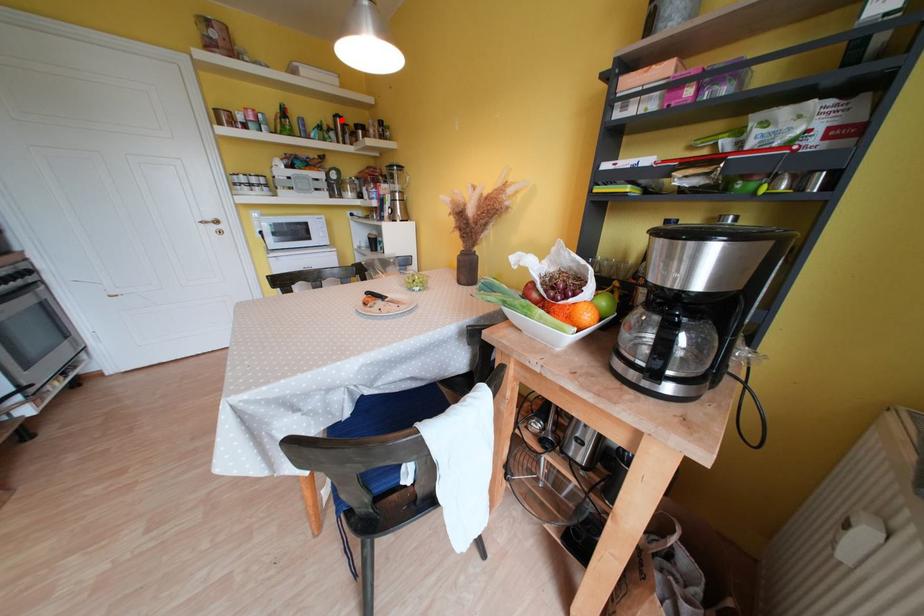
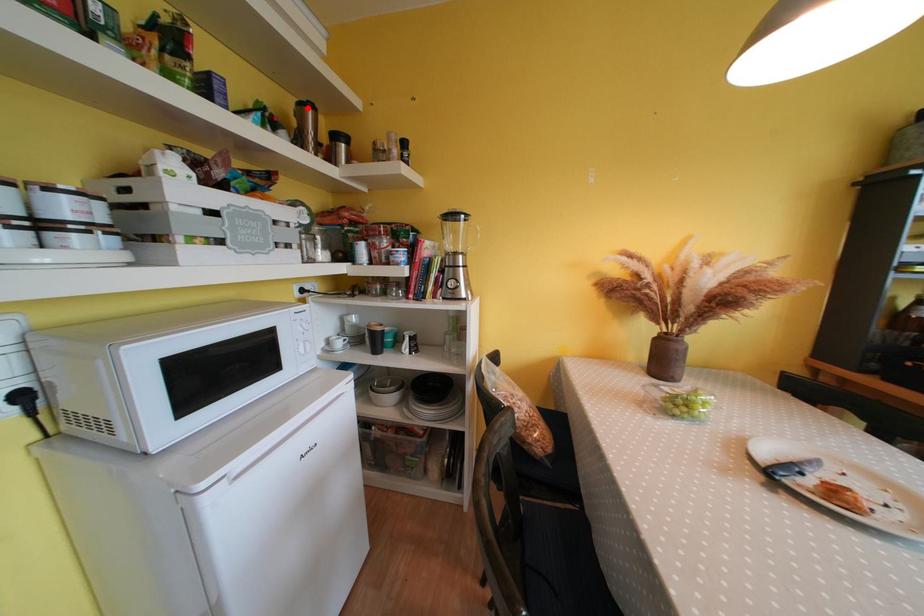
I am providing you with two images of the same scene from different viewpoints. A red point is marked on the first image and another point is marked on the second image. Do the highlighted points in image1 and image2 indicate the same real-world spot?

Yes